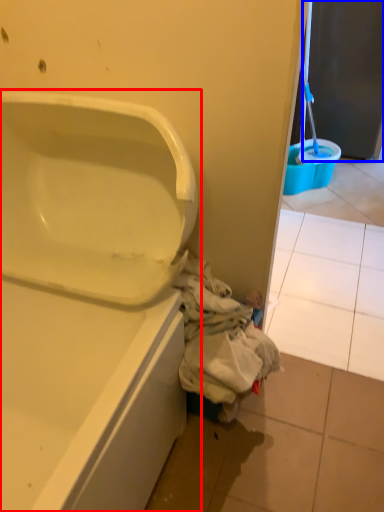
Question: Which point is closer to the camera, bathtub (highlighted by a red box) or screen door (highlighted by a blue box)?

Choices:
 (A) bathtub
 (B) screen door

Answer: (A)